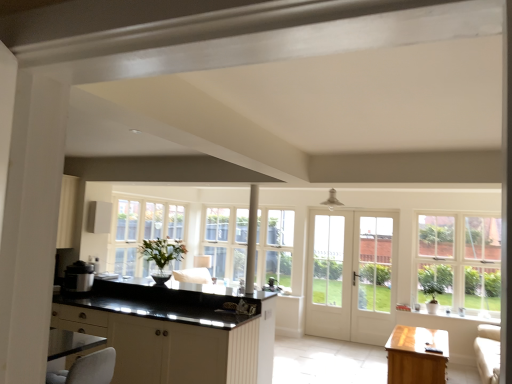
Question: Looking at the image, does white glass door at center seem bigger or smaller compared to matte black rice cooker at left?

Choices:
 (A) small
 (B) big

Answer: (B)

Question: Is white glass door at center taller or shorter than matte black rice cooker at left?

Choices:
 (A) short
 (B) tall

Answer: (B)

Question: Which is nearer to the white glass door at center?

Choices:
 (A) white glass door at center, placed as the first screen door when sorted from left to right
 (B) clear glass window at right
 (C) matte black rice cooker at left
 (D) white glass door at center, which is counted as the first screen door, starting from the right
 (E) light brown wooden table at lower right

Answer: (A)

Question: Estimate the real-world distances between objects in this image. Which object is farther from the white glass door at center, which is counted as the second screen door, starting from the right?

Choices:
 (A) clear glass window at right
 (B) white glass door at center, the 2th screen door positioned from the left
 (C) matte black rice cooker at left
 (D) light brown wooden table at lower right
 (E) white glass door at center

Answer: (C)